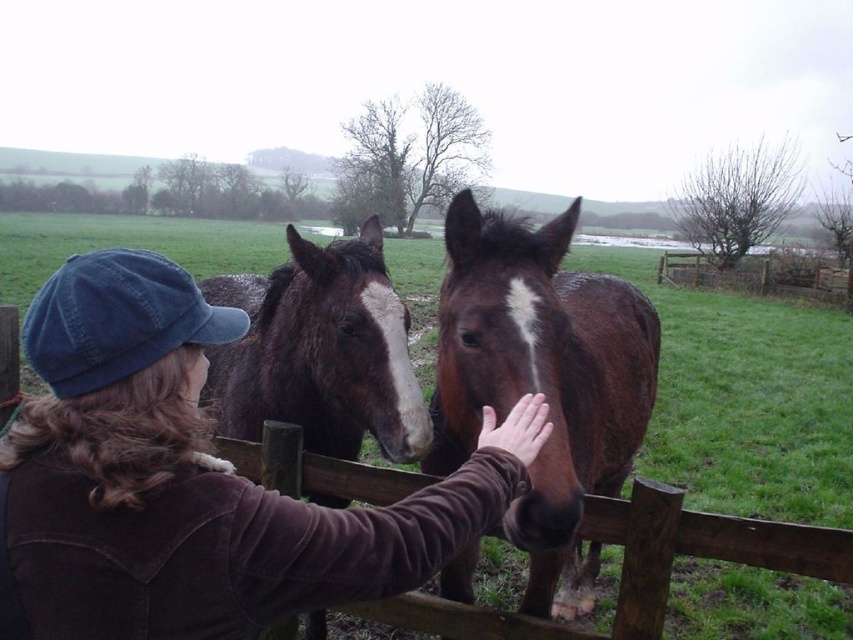
You are standing in the grassy field and want to approach the brown corduroy jacket at center. Based on its position, which direction should you move relative to your current position?

The brown corduroy jacket at center is located at point 0.752 on the x and 0.217 on the y axis. To approach it, you should move towards the right and slightly forward since the coordinates indicate it is positioned to the right and closer to the front of the scene compared to your current position.

You are standing in the rural scene and see the brown corduroy jacket at center. Can you tell me the exact coordinates where it is located?

The brown corduroy jacket at center is located at point (184, 481).

You are standing in the field and want to walk from the brown corduroy jacket at center to the wooden fence at right. Is there enough space between them for you to pass through comfortably?

The brown corduroy jacket at center is wider than the wooden fence at right, so there might not be enough space to pass through comfortably between them.